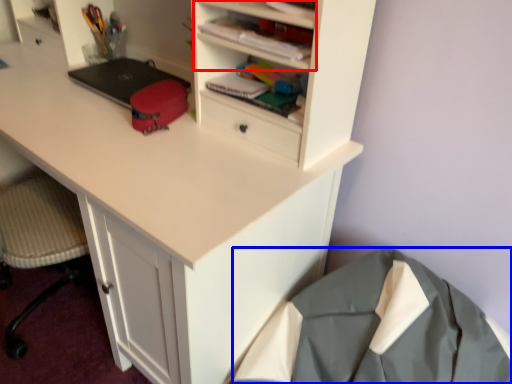
Question: Which object is further to the camera taking this photo, cabinet (highlighted by a red box) or clothing (highlighted by a blue box)?

Choices:
 (A) cabinet
 (B) clothing

Answer: (A)